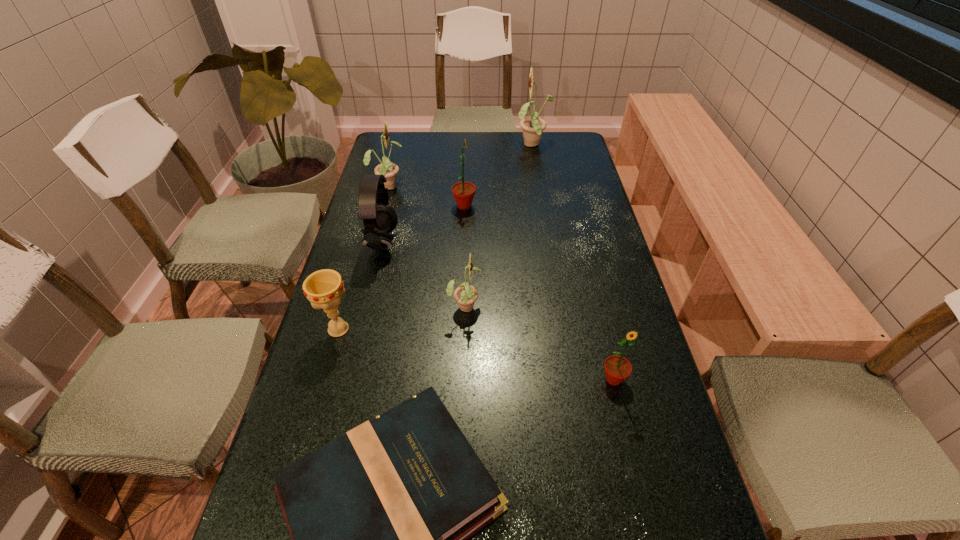
Locate an element on the screen. This screenshot has height=540, width=960. sunflower identified as the third closest to the tallest sunflower is located at coordinates (465, 295).

At what (x,y) coordinates should I click in order to perform the action: click on sunflower that is the closest to the nearest sunflower. Please return your answer as a coordinate pair (x, y). Looking at the image, I should click on (465, 295).

Locate which yellow sunflower is the third closest to the chalice. Please provide its 2D coordinates. Your answer should be formatted as a tuple, i.e. [(x, y)], where the tuple contains the x and y coordinates of a point satisfying the conditions above.

[(533, 127)]

Where is `yellow sunflower object that ranks as the closest to the black earphone`? This screenshot has height=540, width=960. yellow sunflower object that ranks as the closest to the black earphone is located at coordinates (389, 170).

Find the location of a particular element. This screenshot has height=540, width=960. vacant space that satisfies the following two spatial constraints: 1. on the ear cups of the earphone; 2. on the front side of the chalice is located at coordinates click(362, 329).